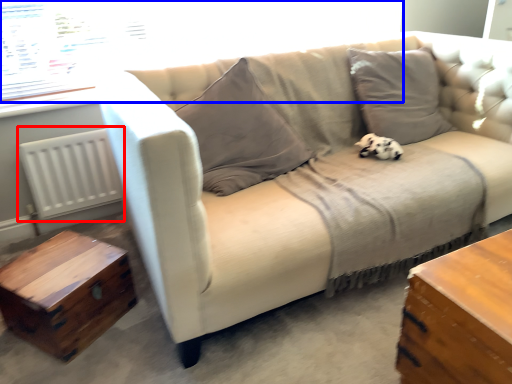
Question: Which of the following is the closest to the observer, radiator (highlighted by a red box) or window screen (highlighted by a blue box)?

Choices:
 (A) radiator
 (B) window screen

Answer: (B)